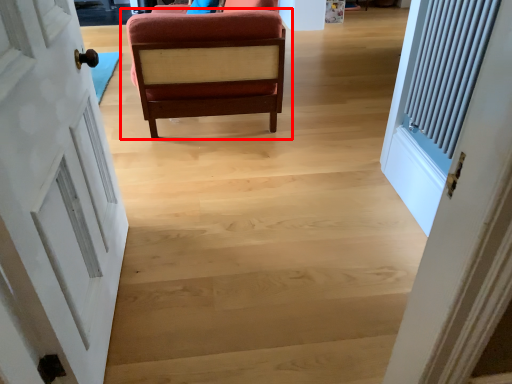
Question: Where is chair (annotated by the red box) located in relation to door in the image?

Choices:
 (A) left
 (B) right

Answer: (B)